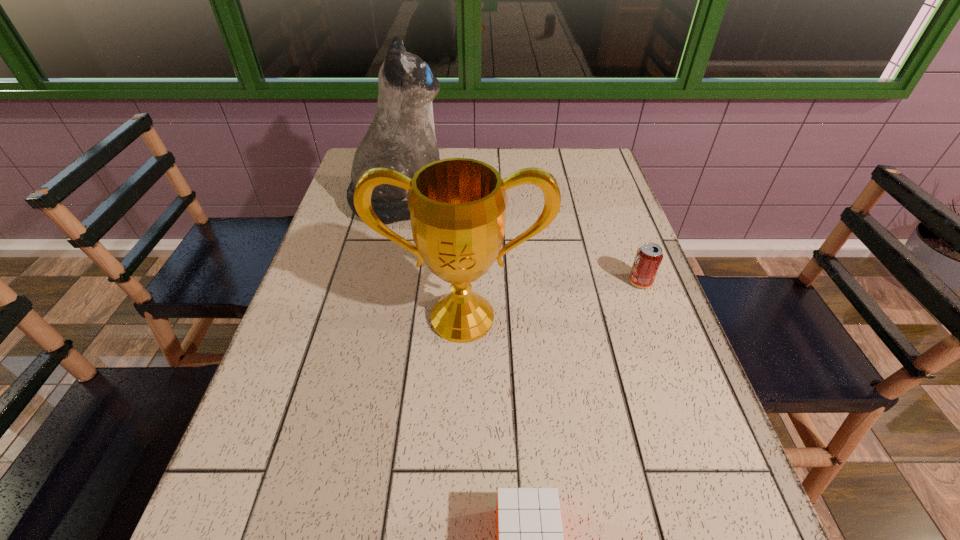
This screenshot has width=960, height=540. I want to click on the farthest object, so click(x=401, y=136).

The height and width of the screenshot is (540, 960). In order to click on the second tallest object in this screenshot , I will do `click(457, 206)`.

You are a GUI agent. You are given a task and a screenshot of the screen. Output one action in this format:
    pyautogui.click(x=<x>, y=<y>)
    Task: Click on the soda can
    The image size is (960, 540).
    Given the screenshot: What is the action you would take?
    pyautogui.click(x=649, y=256)

In order to click on the rightmost object in this screenshot , I will do pos(649,256).

The height and width of the screenshot is (540, 960). I want to click on vacant region located at the face of the farthest object, so [x=592, y=202].

Where is `free space located 0.290m on the front-facing side of the award`? free space located 0.290m on the front-facing side of the award is located at coordinates (456, 490).

Locate an element on the screen. This screenshot has width=960, height=540. vacant area located 0.160m on the back of the rightmost object is located at coordinates (623, 234).

In order to click on object that is positioned at the far edge in this screenshot , I will do `click(401, 136)`.

The image size is (960, 540). In order to click on object situated at the left edge in this screenshot , I will do `click(401, 136)`.

The height and width of the screenshot is (540, 960). I want to click on object that is at the right edge, so click(649, 256).